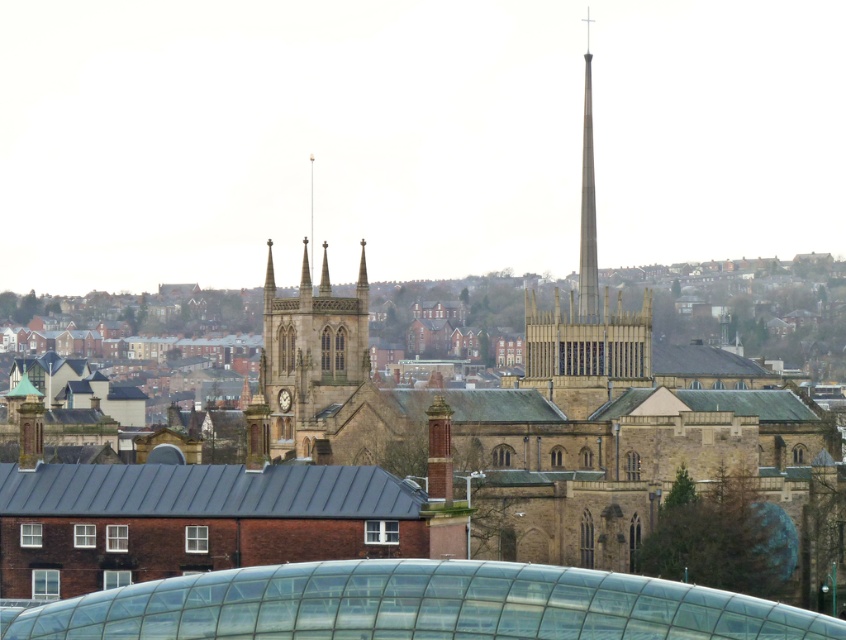
Question: Which object is positioned farthest from the brown stone tower at center?

Choices:
 (A) smooth stone spire at center
 (B) smooth gray spire at center

Answer: (B)

Question: Is brown stone tower at center thinner than smooth stone spire at center?

Choices:
 (A) no
 (B) yes

Answer: (B)

Question: Which object is positioned farthest from the smooth gray spire at center?

Choices:
 (A) smooth stone spire at center
 (B) brown stone tower at center

Answer: (B)

Question: Does brown stone tower at center appear on the left side of smooth gray spire at center?

Choices:
 (A) yes
 (B) no

Answer: (A)

Question: Where is brown stone tower at center located in relation to smooth stone spire at center in the image?

Choices:
 (A) above
 (B) below

Answer: (B)

Question: Among these objects, which one is farthest from the camera?

Choices:
 (A) smooth gray spire at center
 (B) brown stone tower at center

Answer: (A)